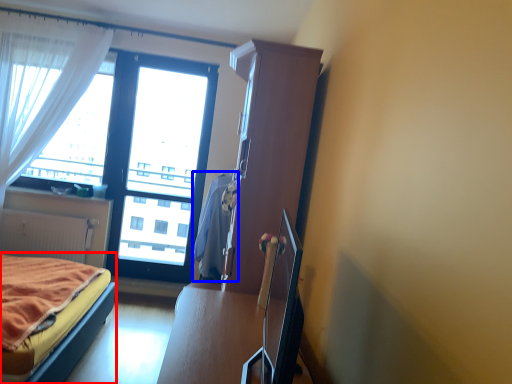
Question: Which point is closer to the camera, bed (highlighted by a red box) or blanket (highlighted by a blue box)?

Choices:
 (A) bed
 (B) blanket

Answer: (A)